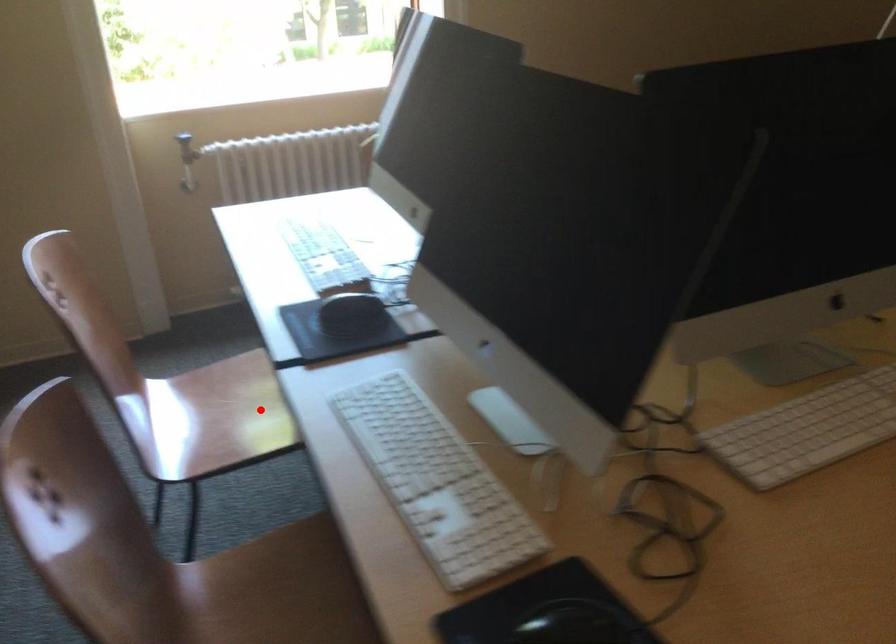
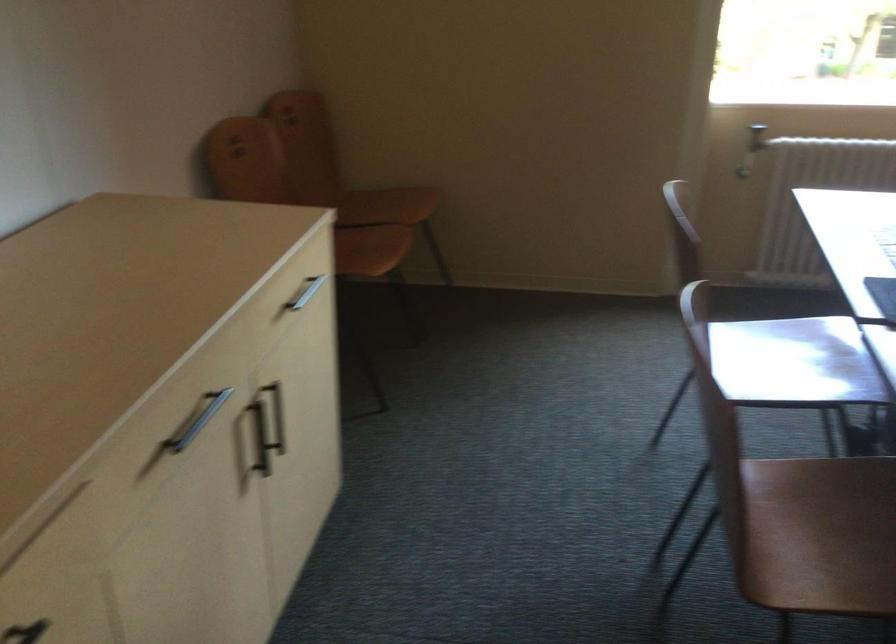
Locate, in the second image, the point that corresponds to the highlighted location in the first image.

(794, 362)